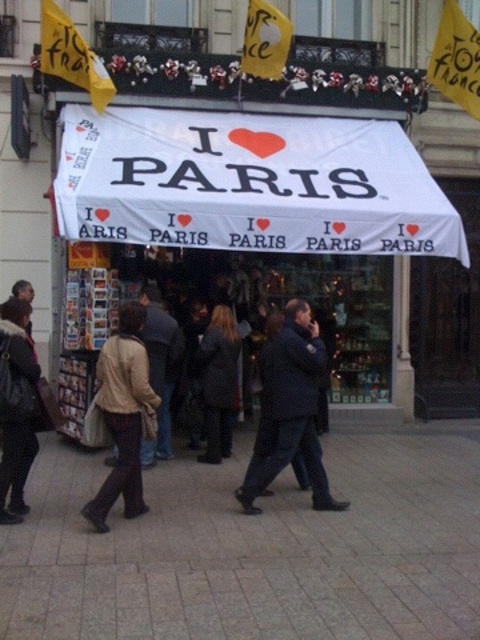
Between point (321, 189) and point (35, 353), which one is positioned in front?

Point (35, 353) is in front.

Image resolution: width=480 pixels, height=640 pixels. What do you see at coordinates (250, 182) in the screenshot?
I see `white fabric canopy at center` at bounding box center [250, 182].

Locate an element on the screen. The image size is (480, 640). white fabric canopy at center is located at coordinates (250, 182).

Is white fabric canopy at center taller than dark blue jacket at center?

Yes.

Does white fabric canopy at center have a lesser height compared to dark blue jacket at center?

Incorrect, white fabric canopy at center's height does not fall short of dark blue jacket at center's.

Which is in front, point (103, 232) or point (302, 404)?

Positioned in front is point (302, 404).

I want to click on white fabric canopy at center, so (x=250, y=182).

How much distance is there between beige fabric jacket at left and beige fabric coat at center?

A distance of 5.03 feet exists between beige fabric jacket at left and beige fabric coat at center.

Which is above, beige fabric jacket at left or beige fabric coat at center?

beige fabric coat at center

Who is more distant from viewer, (133, 508) or (169, 332)?

Point (169, 332)

At what (x,y) coordinates should I click in order to perform the action: click on beige fabric jacket at left. Please return your answer as a coordinate pair (x, y). The image size is (480, 640). Looking at the image, I should click on (122, 413).